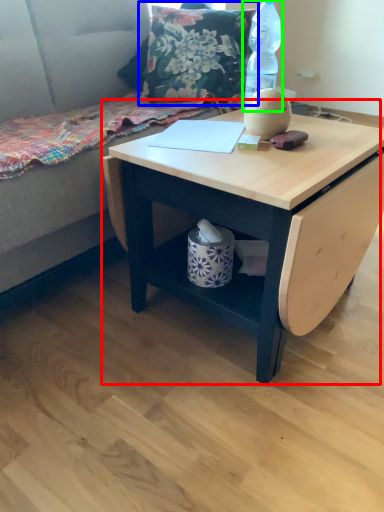
Question: Considering the real-world distances, which object is closest to table (highlighted by a red box)? throw pillow (highlighted by a blue box) or bottle (highlighted by a green box).

Choices:
 (A) throw pillow
 (B) bottle

Answer: (B)